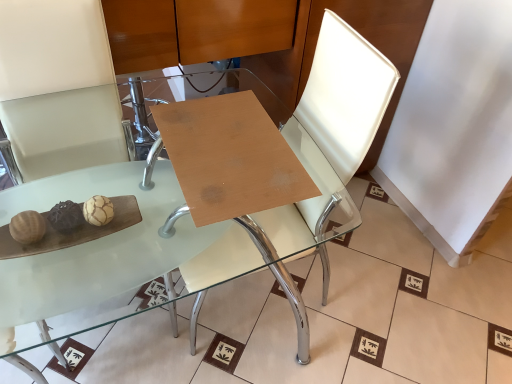
Question: From a real-world perspective, does transparent glass table at center, which ranks as the 2th table in back-to-front order, sit lower than white leather swivel chair at center?

Choices:
 (A) no
 (B) yes

Answer: (B)

Question: From a real-world perspective, is transparent glass table at center, which ranks as the 2th table in back-to-front order, on white leather swivel chair at center?

Choices:
 (A) yes
 (B) no

Answer: (B)

Question: Does transparent glass table at center, which ranks as the 2th table in back-to-front order, have a greater width compared to white leather swivel chair at center?

Choices:
 (A) no
 (B) yes

Answer: (B)

Question: Considering the relative positions of transparent glass table at center, which ranks as the 2th table in back-to-front order, and white leather swivel chair at center in the image provided, is transparent glass table at center, which ranks as the 2th table in back-to-front order, to the right of white leather swivel chair at center from the viewer's perspective?

Choices:
 (A) no
 (B) yes

Answer: (A)

Question: Is white leather swivel chair at center a part of transparent glass table at center, marked as the first table in a front-to-back arrangement?

Choices:
 (A) no
 (B) yes

Answer: (B)

Question: Does transparent glass table at center, which ranks as the 2th table in back-to-front order, have a lesser height compared to white leather swivel chair at center?

Choices:
 (A) yes
 (B) no

Answer: (A)

Question: Does wooden at center, acting as the 2th table starting from the front, appear on the left side of transparent glass table at center, which ranks as the 2th table in back-to-front order?

Choices:
 (A) no
 (B) yes

Answer: (A)

Question: From a real-world perspective, does wooden at center, acting as the 2th table starting from the front, stand above transparent glass table at center, which ranks as the 2th table in back-to-front order?

Choices:
 (A) yes
 (B) no

Answer: (A)

Question: From the image's perspective, is wooden at center, the 1th table in the back-to-front sequence, above transparent glass table at center, which ranks as the 2th table in back-to-front order?

Choices:
 (A) no
 (B) yes

Answer: (B)

Question: Is wooden at center, the 1th table in the back-to-front sequence, in front of transparent glass table at center, marked as the first table in a front-to-back arrangement?

Choices:
 (A) no
 (B) yes

Answer: (A)

Question: Is wooden at center, the 1th table in the back-to-front sequence, bigger than transparent glass table at center, marked as the first table in a front-to-back arrangement?

Choices:
 (A) no
 (B) yes

Answer: (A)

Question: From a real-world perspective, is wooden at center, acting as the 2th table starting from the front, positioned under transparent glass table at center, which ranks as the 2th table in back-to-front order, based on gravity?

Choices:
 (A) yes
 (B) no

Answer: (B)

Question: Is wooden at center, acting as the 2th table starting from the front, positioned in front of white leather swivel chair at center?

Choices:
 (A) no
 (B) yes

Answer: (A)